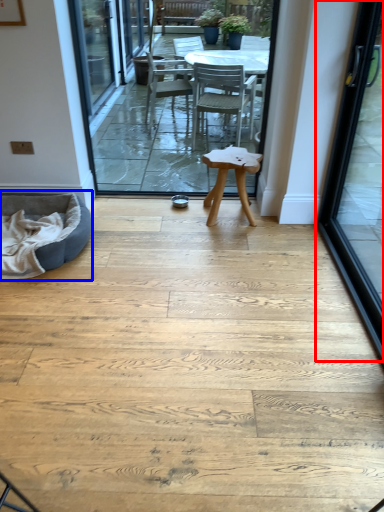
Question: Which point is further to the camera, door (highlighted by a red box) or bean bag chair (highlighted by a blue box)?

Choices:
 (A) door
 (B) bean bag chair

Answer: (B)